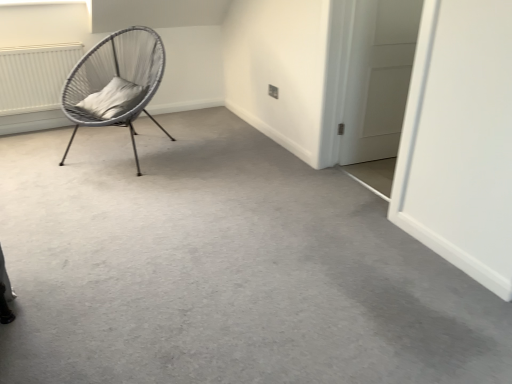
Where is `vacant space in front of woven grey chair at left`? Image resolution: width=512 pixels, height=384 pixels. vacant space in front of woven grey chair at left is located at coordinates (104, 188).